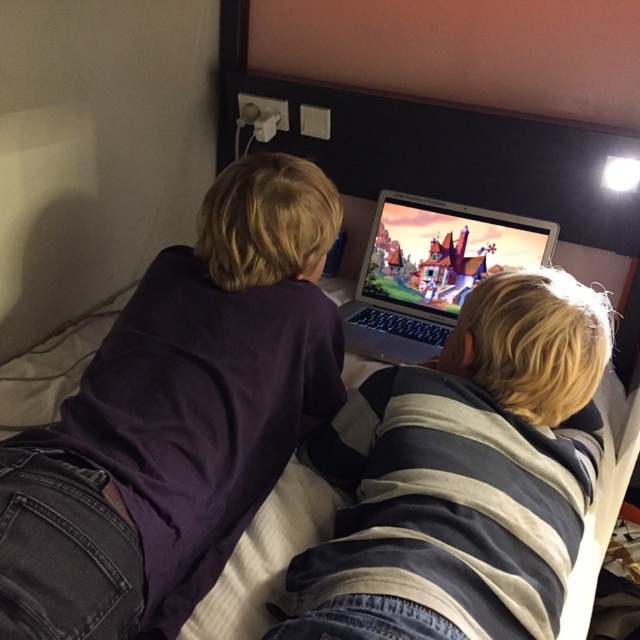
You are a fashion designer observing the children and their clothing in the image. You need to determine which clothing item is narrower between the purple matte shirt at upper left and the striped hoodie at center. Which one should you choose?

The purple matte shirt at upper left has a lesser width compared to the striped hoodie at center, so you should choose the purple matte shirt at upper left as the narrower option.

You are a photographer taking a picture of the purple matte shirt at upper left and the striped hoodie at center. Which one will be more visible in the photo due to their positions?

The purple matte shirt at upper left is in front of the striped hoodie at center, so it will be more visible in the photo.

Looking at this image, you are a photographer taking a picture of the striped hoodie at center and the satin silver laptop at upper center. Which object will appear larger in the photo?

The striped hoodie at center will appear larger in the photo because it is closer to the viewer than the satin silver laptop at upper center.